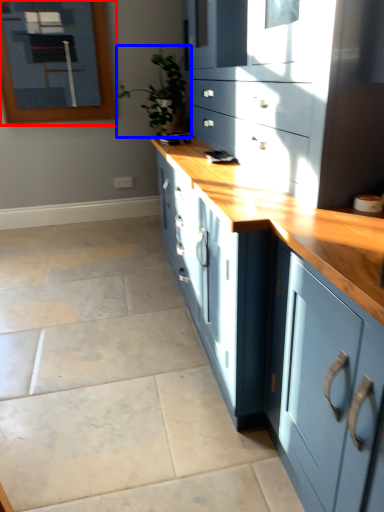
Question: Which of the following is the farthest to the observer, picture frame (highlighted by a red box) or houseplant (highlighted by a blue box)?

Choices:
 (A) picture frame
 (B) houseplant

Answer: (A)